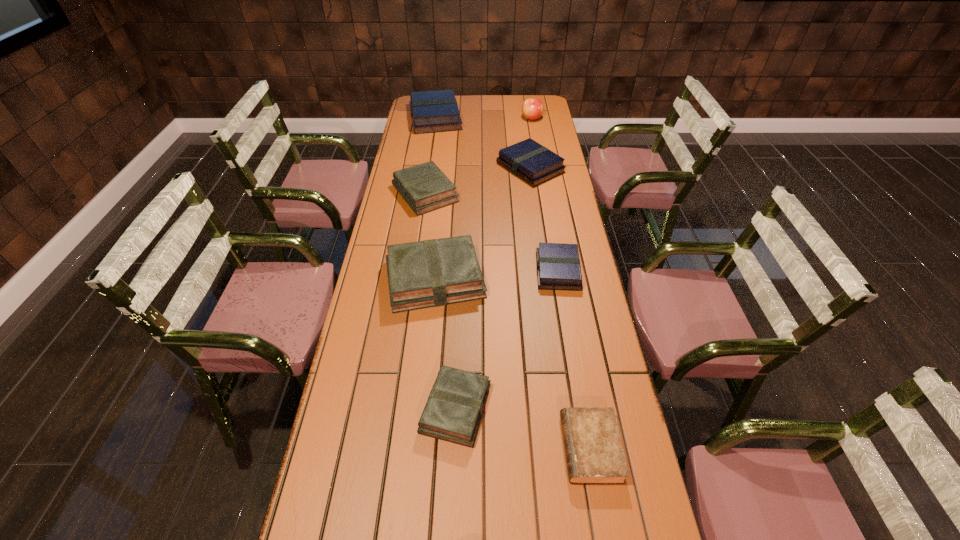
The width and height of the screenshot is (960, 540). I want to click on free spot located on the back of the tallest object, so click(530, 107).

Locate an element on the screen. vacant space located 0.130m on the front of the farthest book is located at coordinates (431, 148).

Identify the location of vacant space located on the right of the second nearest greenish book. Image resolution: width=960 pixels, height=540 pixels. (505, 279).

The height and width of the screenshot is (540, 960). I want to click on vacant space located 0.060m on the left of the second nearest blue book, so click(483, 168).

Find the location of `vacant point located on the back of the farthest greenish book`. vacant point located on the back of the farthest greenish book is located at coordinates tap(430, 163).

Find the location of a particular element. blank space located on the left of the smallest blue book is located at coordinates (462, 271).

Where is `vacant space located 0.090m on the back of the smallest greenish book`? This screenshot has height=540, width=960. vacant space located 0.090m on the back of the smallest greenish book is located at coordinates (458, 346).

Locate an element on the screen. vacant area located 0.110m on the spine side of the diary is located at coordinates (517, 448).

Identify the location of free space located 0.170m on the spine side of the diary. The image size is (960, 540). (492, 448).

Where is `vacant area located on the spine side of the diary`? vacant area located on the spine side of the diary is located at coordinates (460, 448).